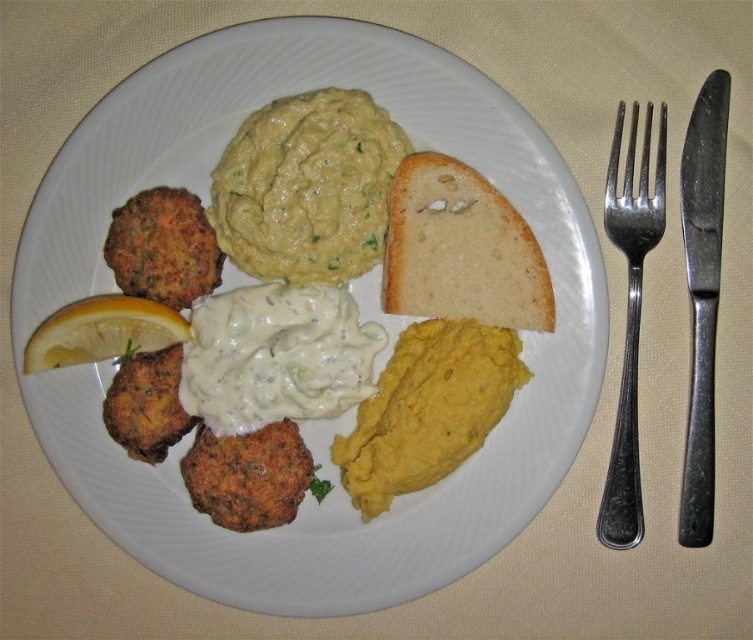
Question: Is green creamy hummus at center bigger than yellow creamy mashed potato at center?

Choices:
 (A) yes
 (B) no

Answer: (A)

Question: Which object is the farthest from the white matte bread at upper center?

Choices:
 (A) green creamy hummus at center
 (B) yellow matte lemon at left

Answer: (B)

Question: Is yellow creamy mashed potato at center smaller than white matte bread at upper center?

Choices:
 (A) yes
 (B) no

Answer: (B)

Question: Considering the relative positions of white matte bread at upper center and silver metallic fork at upper right in the image provided, where is white matte bread at upper center located with respect to silver metallic fork at upper right?

Choices:
 (A) left
 (B) right

Answer: (A)

Question: Which object appears closest to the camera in this image?

Choices:
 (A) silver metallic fork at upper right
 (B) green creamy hummus at center

Answer: (B)

Question: Which of the following is the farthest from the observer?

Choices:
 (A) silver metallic fork at upper right
 (B) yellow matte lemon at left
 (C) yellow creamy mashed potato at center

Answer: (C)